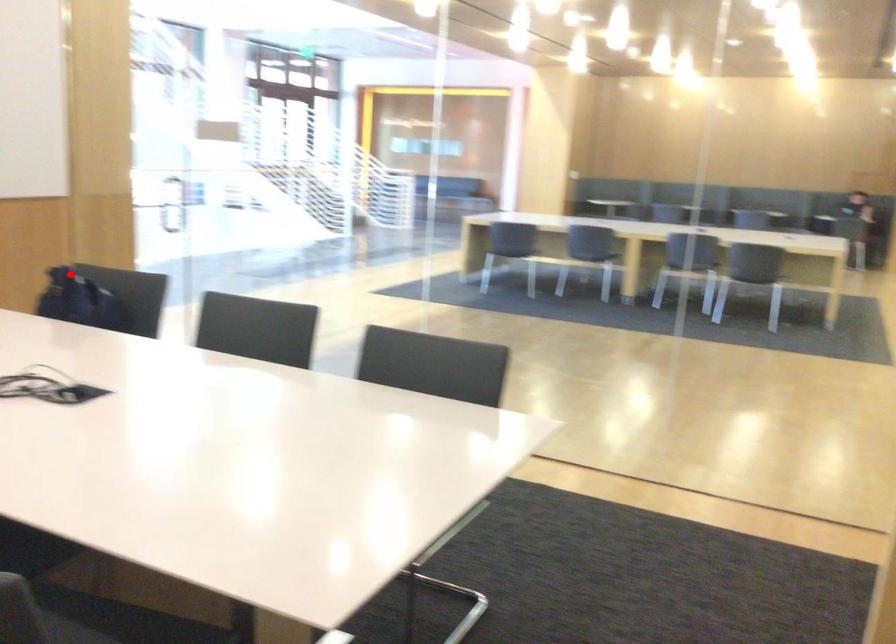
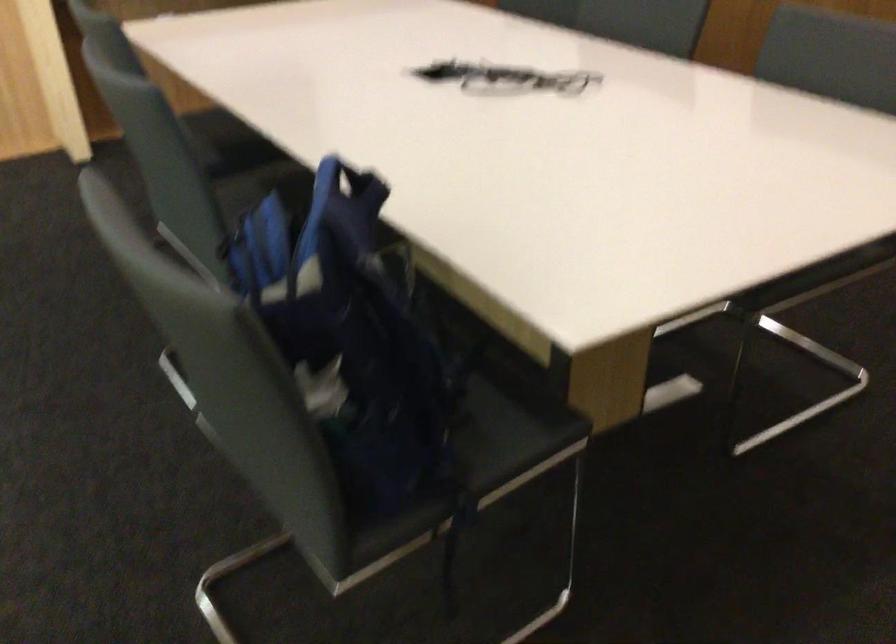
Question: I am providing you with two images of the same scene from different viewpoints. In image1, a red point is highlighted. Considering the same 3D point in image2, which of the following is correct?

Choices:
 (A) It is closer
 (B) It is farther

Answer: (A)